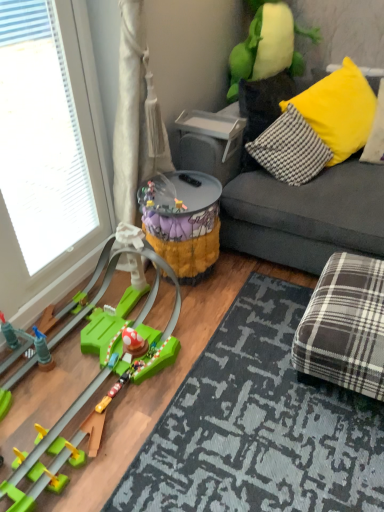
Consider the image. What is the approximate height of yellow fabric pillow at upper right?

The height of yellow fabric pillow at upper right is 15.82 inches.

What do you see at coordinates (184, 222) in the screenshot?
I see `camouflage fabric bucket at center, arranged as the second toy when viewed from the top` at bounding box center [184, 222].

The image size is (384, 512). Find the location of `dark gray fabric couch at center`. dark gray fabric couch at center is located at coordinates (306, 215).

Consider the image. What is the approximate height of dark gray fabric couch at center?

dark gray fabric couch at center is 30.39 inches tall.

This screenshot has height=512, width=384. Find the location of `brown plaid stool at lower right`. brown plaid stool at lower right is located at coordinates (345, 326).

What is the approximate height of soft plush toy at upper right, acting as the 3th toy starting from the bottom?

22.30 inches.

What is the approximate height of yellow fabric pillow at upper right, the second pillow viewed from the right?

It is 63.93 centimeters.

Where is `yellow fabric pillow at upper right`? The width and height of the screenshot is (384, 512). yellow fabric pillow at upper right is located at coordinates (290, 149).

Is there a large distance between soft plush toy at upper right, acting as the 3th toy starting from the bottom, and transparent glass window at left?

Yes, soft plush toy at upper right, acting as the 3th toy starting from the bottom, and transparent glass window at left are located far from each other.

Where is `toy that is the 3rd one when counting rightward from the transparent glass window at left`? The height and width of the screenshot is (512, 384). toy that is the 3rd one when counting rightward from the transparent glass window at left is located at coordinates (268, 46).

Does point (206, 227) come in front of point (25, 40)?

No, (206, 227) is further to viewer.

Consider the image. Between camouflage fabric bucket at center, which ranks as the 2th toy in bottom-to-top order, and transparent glass window at left, which one appears on the left side from the viewer's perspective?

transparent glass window at left is more to the left.

Between camouflage fabric bucket at center, which ranks as the 2th toy in bottom-to-top order, and transparent glass window at left, which one has larger width?

With larger width is camouflage fabric bucket at center, which ranks as the 2th toy in bottom-to-top order.

From the picture: Is camouflage fabric bucket at center, which ranks as the 2th toy in bottom-to-top order, facing away from transparent glass window at left?

No, camouflage fabric bucket at center, which ranks as the 2th toy in bottom-to-top order, is not facing the opposite direction of transparent glass window at left.

Can you confirm if plaid fabric mat at lower right is thinner than yellow fabric pillow at upper right, the 1th pillow positioned from the right?

No, plaid fabric mat at lower right is not thinner than yellow fabric pillow at upper right, the 1th pillow positioned from the right.

Considering the relative sizes of plaid fabric mat at lower right and yellow fabric pillow at upper right, the 1th pillow positioned from the right, in the image provided, is plaid fabric mat at lower right taller than yellow fabric pillow at upper right, the 1th pillow positioned from the right,?

No, plaid fabric mat at lower right is not taller than yellow fabric pillow at upper right, the 1th pillow positioned from the right.

Choose the correct answer: Is plaid fabric mat at lower right inside yellow fabric pillow at upper right, the 1th pillow positioned from the right, or outside it?

plaid fabric mat at lower right is outside yellow fabric pillow at upper right, the 1th pillow positioned from the right.

Is yellow fabric pillow at upper right, the 1th pillow positioned from the right, inside the boundaries of transparent glass window at left, or outside?

yellow fabric pillow at upper right, the 1th pillow positioned from the right, lies outside transparent glass window at left.

Is yellow fabric pillow at upper right, which is the second pillow in left-to-right order, oriented towards transparent glass window at left?

No, yellow fabric pillow at upper right, which is the second pillow in left-to-right order, is not oriented towards transparent glass window at left.

Where is `pillow that is the 2nd object to the right of the transparent glass window at left, starting at the anchor`? The width and height of the screenshot is (384, 512). pillow that is the 2nd object to the right of the transparent glass window at left, starting at the anchor is located at coordinates (376, 133).

Considering the relative sizes of yellow fabric pillow at upper right, the 1th pillow positioned from the right, and transparent glass window at left in the image provided, is yellow fabric pillow at upper right, the 1th pillow positioned from the right, wider than transparent glass window at left?

Yes.

Which pillow is the 1st one when counting from the right side of the camouflage fabric bucket at center, which ranks as the 2th toy in bottom-to-top order? Please provide its 2D coordinates.

[(339, 110)]

Is yellow fabric pillow at upper right, which is the 1th pillow from left to right, oriented towards camouflage fabric bucket at center, arranged as the second toy when viewed from the top?

No.

Considering the points (302, 114) and (183, 253), which point is in front, point (302, 114) or point (183, 253)?

The point (183, 253) is closer.

Is yellow fabric pillow at upper right, the second pillow viewed from the right, to the left or to the right of camouflage fabric bucket at center, arranged as the second toy when viewed from the top, in the image?

yellow fabric pillow at upper right, the second pillow viewed from the right, is to the right of camouflage fabric bucket at center, arranged as the second toy when viewed from the top.

From the picture: Considering the relative positions of plaid fabric mat at lower right and yellow fabric pillow at upper right, the second pillow viewed from the right, in the image provided, is plaid fabric mat at lower right in front of yellow fabric pillow at upper right, the second pillow viewed from the right,?

That is True.

How distant is plaid fabric mat at lower right from yellow fabric pillow at upper right, which is the 1th pillow from left to right?

The distance of plaid fabric mat at lower right from yellow fabric pillow at upper right, which is the 1th pillow from left to right, is 3.69 feet.

From the image's perspective, is plaid fabric mat at lower right located above or below yellow fabric pillow at upper right, which is the 1th pillow from left to right?

Clearly, from the image's perspective, plaid fabric mat at lower right is below yellow fabric pillow at upper right, which is the 1th pillow from left to right.

From a real-world perspective, is yellow fabric pillow at upper right, the second pillow viewed from the right, positioned under yellow fabric pillow at upper right, which is the second pillow in left-to-right order, based on gravity?

Indeed, from a real-world perspective, yellow fabric pillow at upper right, the second pillow viewed from the right, is positioned beneath yellow fabric pillow at upper right, which is the second pillow in left-to-right order.

Does yellow fabric pillow at upper right, the second pillow viewed from the right, appear on the right side of yellow fabric pillow at upper right, which is the second pillow in left-to-right order?

No.

Locate an element on the screen. This screenshot has width=384, height=512. pillow lying behind the yellow fabric pillow at upper right, which is the 1th pillow from left to right is located at coordinates (376, 133).

In the image, there is a soft plush toy at upper right, acting as the 3th toy starting from the bottom. In order to click on window below it (from the image's perspective) in this screenshot , I will do `click(41, 137)`.

Find the location of `window above the camouflage fabric bucket at center, which ranks as the 2th toy in bottom-to-top order (from the image's perspective)`. window above the camouflage fabric bucket at center, which ranks as the 2th toy in bottom-to-top order (from the image's perspective) is located at coordinates (41, 137).

Based on their spatial positions, is dark gray fabric couch at center or yellow fabric pillow at upper right further from brown plaid stool at lower right?

yellow fabric pillow at upper right is further to brown plaid stool at lower right.

Which object lies nearer to the anchor point plaid fabric mat at lower right, yellow fabric pillow at upper right or yellow fabric pillow at upper right, the second pillow viewed from the right?

Based on the image, yellow fabric pillow at upper right appears to be nearer to plaid fabric mat at lower right.

From the image, which object appears to be nearer to brown plaid stool at lower right, soft plush toy at upper right, the 1th toy from the top, or yellow fabric pillow at upper right, which is the second pillow in left-to-right order?

yellow fabric pillow at upper right, which is the second pillow in left-to-right order, lies closer to brown plaid stool at lower right than the other object.

Considering their positions, is plaid fabric mat at lower right positioned closer to soft plush toy at upper right, the 1th toy from the top, than dark gray fabric couch at center?

Among the two, dark gray fabric couch at center is located nearer to soft plush toy at upper right, the 1th toy from the top.

Estimate the real-world distances between objects in this image. Which object is further from plaid fabric mat at lower right, yellow fabric pillow at upper right or green plastic toy at lower left, acting as the first toy starting from the bottom?

yellow fabric pillow at upper right.

Based on their spatial positions, is transparent glass window at left or camouflage fabric bucket at center, arranged as the second toy when viewed from the top, closer to yellow fabric pillow at upper right?

Among the two, camouflage fabric bucket at center, arranged as the second toy when viewed from the top, is located nearer to yellow fabric pillow at upper right.

Estimate the real-world distances between objects in this image. Which object is further from brown plaid stool at lower right, dark gray fabric couch at center or plaid fabric mat at lower right?

Among the two, dark gray fabric couch at center is located further to brown plaid stool at lower right.

From the image, which object appears to be nearer to camouflage fabric bucket at center, arranged as the second toy when viewed from the top, yellow fabric pillow at upper right, which is the second pillow in left-to-right order, or plaid fabric mat at lower right?

Among the two, plaid fabric mat at lower right is located nearer to camouflage fabric bucket at center, arranged as the second toy when viewed from the top.

Locate an element on the screen. throw pillow situated between green plastic toy at lower left, the 3th toy when ordered from top to bottom, and yellow fabric pillow at upper right, which is the 1th pillow from left to right, from left to right is located at coordinates (290, 149).

The width and height of the screenshot is (384, 512). Identify the location of throw pillow that lies between yellow fabric pillow at upper right, which is the second pillow in left-to-right order, and plaid fabric mat at lower right from top to bottom. (290, 149).

Find the location of `window that lies between soft plush toy at upper right, acting as the 3th toy starting from the bottom, and green plastic toy at lower left, acting as the first toy starting from the bottom, from top to bottom`. window that lies between soft plush toy at upper right, acting as the 3th toy starting from the bottom, and green plastic toy at lower left, acting as the first toy starting from the bottom, from top to bottom is located at coordinates (41, 137).

What are the coordinates of `studio couch that lies between soft plush toy at upper right, the 1th toy from the top, and green plastic toy at lower left, acting as the first toy starting from the bottom, from top to bottom` in the screenshot? It's located at point(306,215).